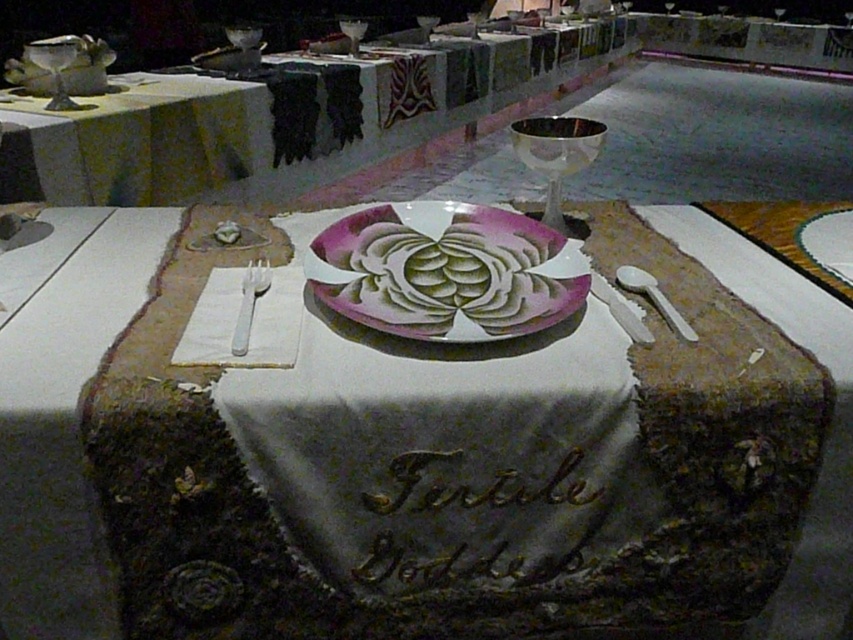
Is silver metallic goblet at center shorter than shiny silver wine glass at center?

Yes.

Is silver metallic goblet at center positioned at the back of shiny silver wine glass at center?

No, it is not.

Between point (590, 157) and point (427, 36), which one is positioned behind?

The point (427, 36) is behind.

This screenshot has width=853, height=640. Identify the location of silver metallic goblet at center. (556, 157).

Who is higher up, white fabric table at center or pink glossy platter at center?

pink glossy platter at center is above.

Looking at this image, who is more forward, (553, 618) or (538, 312)?

Point (553, 618)

Where is `white fabric table at center`? The width and height of the screenshot is (853, 640). white fabric table at center is located at coordinates (419, 445).

From the picture: Which is more to the left, white fabric table at center or silver metallic goblet at center?

white fabric table at center

Between point (126, 440) and point (581, 138), which one is positioned behind?

The point (581, 138) is behind.

Is point (560, 529) farther from viewer compared to point (534, 138)?

No, it is in front of (534, 138).

Locate an element on the screen. The image size is (853, 640). white fabric table at center is located at coordinates (419, 445).